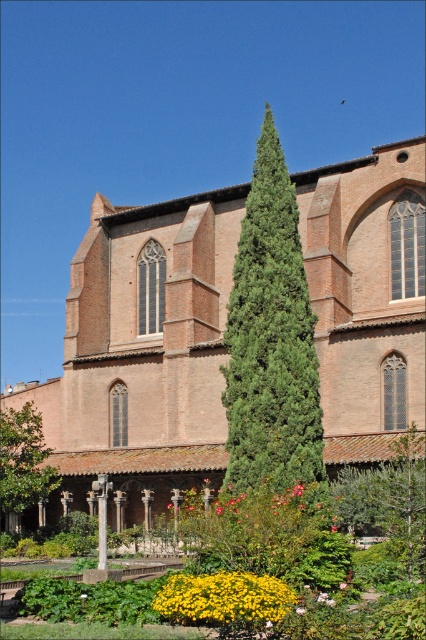
Which of these two, yellow matte flower at lower center or green leafy tree at lower left, stands taller?

green leafy tree at lower left

Who is more distant from viewer, (175,579) or (9,502)?

Point (9,502)

The width and height of the screenshot is (426, 640). I want to click on yellow matte flower at lower center, so click(x=224, y=598).

Does brick wall church at center have a smaller size compared to yellow matte flower at lower center?

Actually, brick wall church at center might be larger than yellow matte flower at lower center.

Is brick wall church at center taller than yellow matte flower at lower center?

A: Correct, brick wall church at center is much taller as yellow matte flower at lower center.

Does point (115, 445) lie in front of point (181, 611)?

No, it is not.

At what (x,y) coordinates should I click in order to perform the action: click on brick wall church at center. Please return your answer as a coordinate pair (x, y). This screenshot has width=426, height=640. Looking at the image, I should click on (143, 352).

Is green textured tree at center positioned behind green leafy tree at lower left?

No, it is not.

Does green textured tree at center come in front of green leafy tree at lower left?

Yes, green textured tree at center is closer to the viewer.

Describe the element at coordinates (271, 340) in the screenshot. I see `green textured tree at center` at that location.

Identify the location of green textured tree at center. The image size is (426, 640). (271, 340).